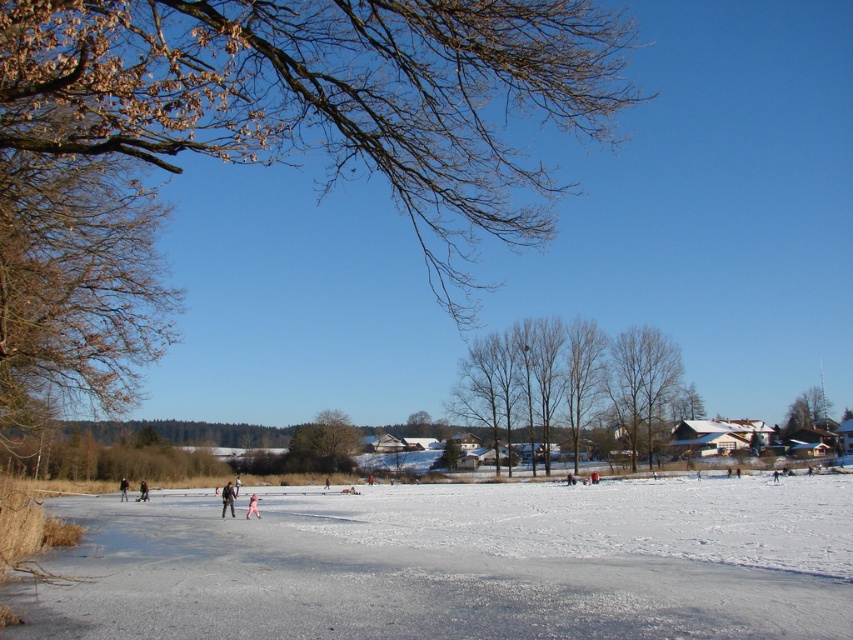
Is brown textured tree at center closer to camera compared to dark blue jacket at center?

No, it is not.

Based on the photo, between brown textured tree at center and dark blue jacket at center, which one appears on the right side from the viewer's perspective?

brown textured tree at center is more to the right.

The width and height of the screenshot is (853, 640). What are the coordinates of `brown textured tree at center` in the screenshot? It's located at (642, 385).

Measure the distance from green leafy tree at upper right to dark brown leather jacket at lower left.

green leafy tree at upper right is 54.91 meters away from dark brown leather jacket at lower left.

Can you confirm if green leafy tree at upper right is smaller than dark brown leather jacket at lower left?

Actually, green leafy tree at upper right might be larger than dark brown leather jacket at lower left.

Where is `green leafy tree at upper right`? The width and height of the screenshot is (853, 640). green leafy tree at upper right is located at coordinates (808, 412).

Between smooth bark trees at center and dark blue jacket at center, which one is positioned lower?

dark blue jacket at center

Is smooth bark trees at center above dark blue jacket at center?

Yes, smooth bark trees at center is above dark blue jacket at center.

In order to click on smooth bark trees at center in this screenshot , I will do `click(569, 380)`.

Image resolution: width=853 pixels, height=640 pixels. In order to click on smooth bark trees at center in this screenshot , I will do `click(569, 380)`.